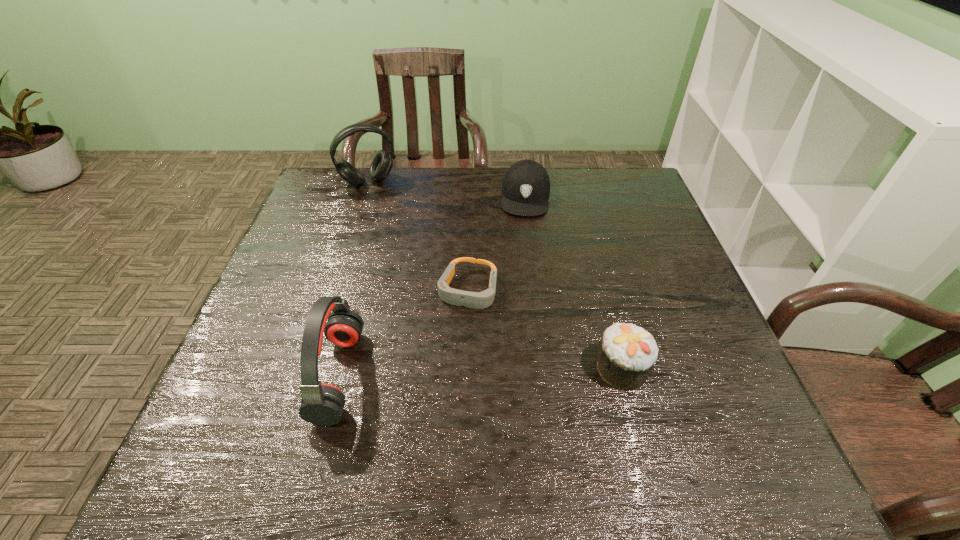
Where is `vacant region located 0.300m on the front-facing side of the fourth object from left to right`? vacant region located 0.300m on the front-facing side of the fourth object from left to right is located at coordinates (517, 295).

At what (x,y) coordinates should I click in order to perform the action: click on free location located on the front and back of the third object from left to right. Please return your answer as a coordinate pair (x, y). Looking at the image, I should click on (442, 371).

Where is `free space located 0.120m on the front and back of the third object from left to right`? The image size is (960, 540). free space located 0.120m on the front and back of the third object from left to right is located at coordinates (445, 359).

You are a GUI agent. You are given a task and a screenshot of the screen. Output one action in this format:
    pyautogui.click(x=<x>, y=<y>)
    Task: Click on the vacant space located on the front and back of the third object from left to right
    The height and width of the screenshot is (540, 960).
    Given the screenshot: What is the action you would take?
    pyautogui.click(x=443, y=367)

The width and height of the screenshot is (960, 540). Identify the location of vacant region located 0.380m on the earcups of the headset. (419, 269).

The height and width of the screenshot is (540, 960). In order to click on blank space located 0.360m on the earcups of the headset in this screenshot , I will do `click(416, 265)`.

The image size is (960, 540). I want to click on vacant space located on the earcups of the headset, so click(386, 208).

Locate an element on the screen. The width and height of the screenshot is (960, 540). cap positioned at the far edge is located at coordinates (x=526, y=185).

Identify the location of headset present at the far edge. The image size is (960, 540). point(382,163).

The image size is (960, 540). Find the location of `earphone that is at the near edge`. earphone that is at the near edge is located at coordinates (322, 404).